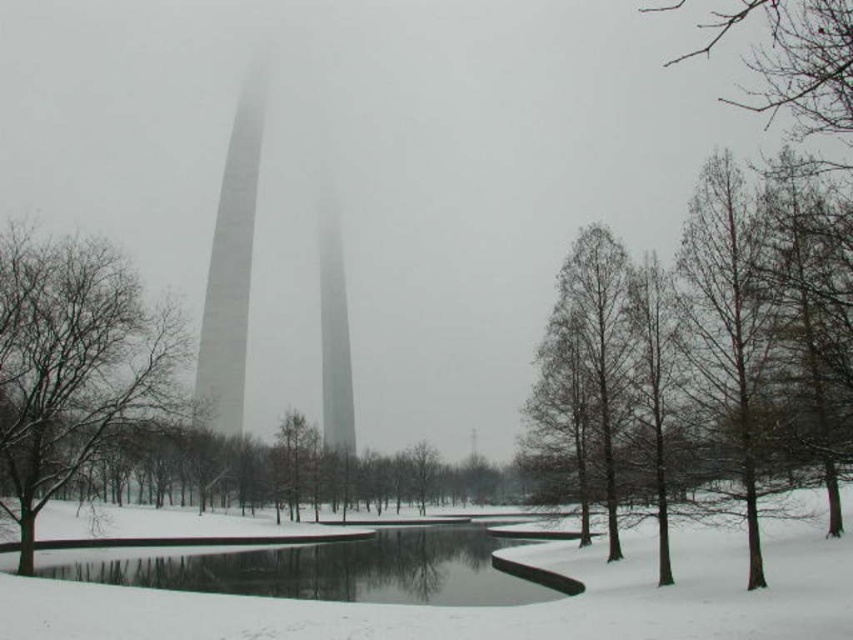
You are standing at the center of the winter scene and want to walk towards the brown bark tree at right. Based on its position, in which general direction should you head?

The brown bark tree at right is located at point [712,364], which is to the right and slightly forward from your current position at the center. You should head towards the right and slightly forward direction to reach it.

You are an architect evaluating the winter scene. You need to determine which structure is shorter between the brown bark tree at right and the white smooth tower at center. Which one is shorter?

The brown bark tree at right is not as tall as the white smooth tower at center, so the brown bark tree at right is shorter.

You are standing at the center of the image and want to walk towards the point marked as point (x=712, y=364). Which direction should you go to reach the brown bark tree at right?

The point (x=712, y=364) corresponds to the brown bark tree at right, so you should walk towards the right direction to reach it.